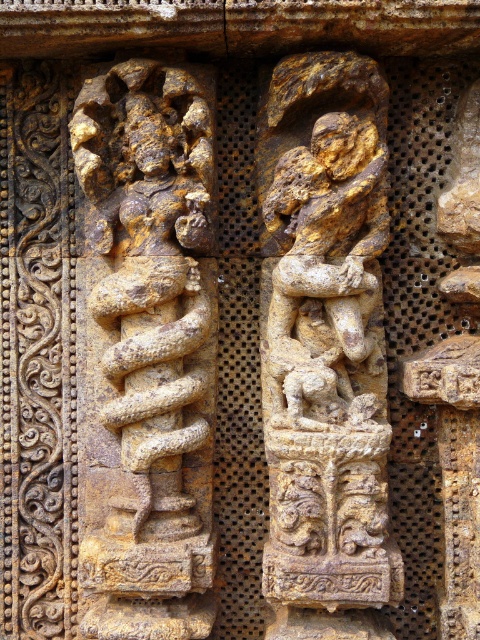
Is point (137, 216) less distant than point (276, 614)?

Yes.

Based on the photo, who is lower down, golden stone snake at left or golden stone figure at center?

Positioned lower is golden stone snake at left.

Where is `golden stone snake at left`? golden stone snake at left is located at coordinates click(145, 353).